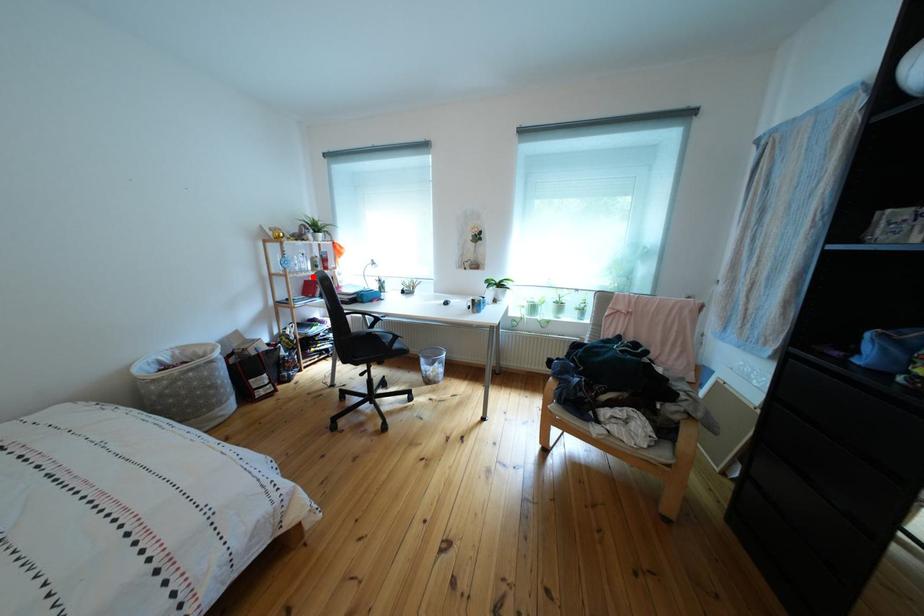
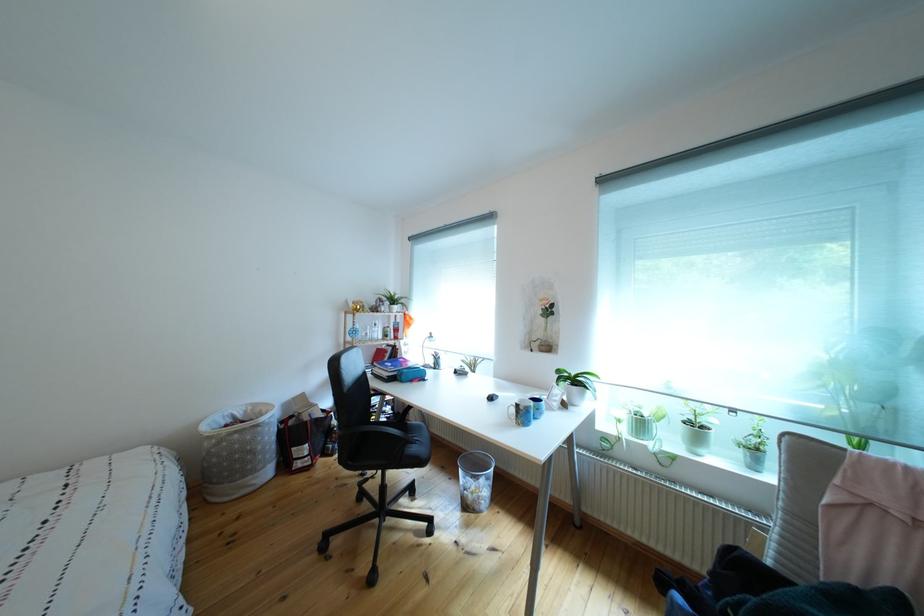
Find the pixel in the second image that matches the highlighted location in the first image.

(383, 345)